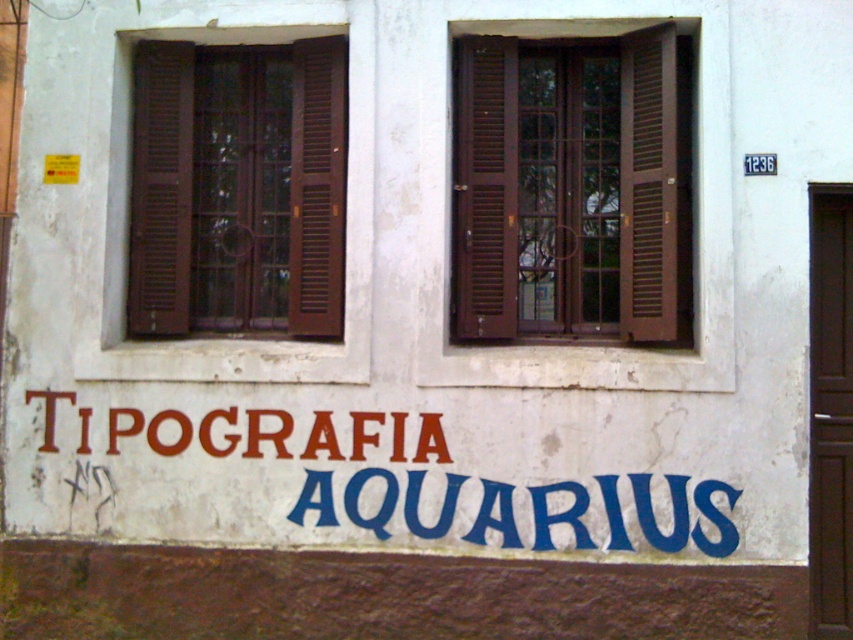
Question: Observing the image, what is the correct spatial positioning of brown wooden window at upper center in reference to brown wooden window at left?

Choices:
 (A) left
 (B) right

Answer: (B)

Question: Which point is farther to the camera?

Choices:
 (A) brown wooden window at left
 (B) red paint sign at center
 (C) brown wooden window at upper center

Answer: (A)

Question: Based on their relative distances, which object is nearer to the red paint sign at center?

Choices:
 (A) brown wooden window at upper center
 (B) brown wooden window at left

Answer: (B)

Question: Which object is closer to the camera taking this photo?

Choices:
 (A) brown wooden window at upper center
 (B) brown wooden window at left
 (C) red paint sign at center

Answer: (C)

Question: Is brown wooden window at upper center behind red paint sign at center?

Choices:
 (A) yes
 (B) no

Answer: (A)

Question: Observing the image, what is the correct spatial positioning of brown wooden window at left in reference to red paint sign at center?

Choices:
 (A) right
 (B) left

Answer: (B)